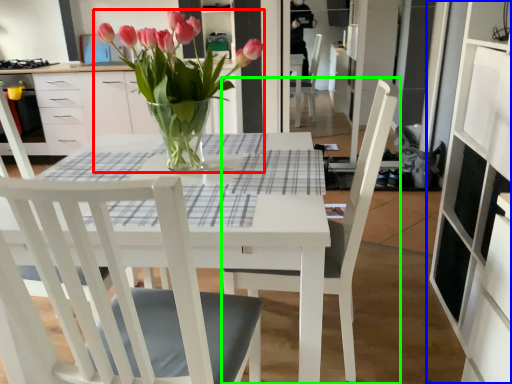
Question: Estimate the real-world distances between objects in this image. Which object is closer to houseplant (highlighted by a red box), cabinetry (highlighted by a blue box) or chair (highlighted by a green box)?

Choices:
 (A) cabinetry
 (B) chair

Answer: (B)